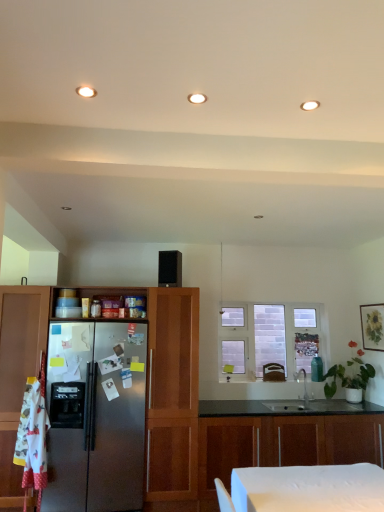
Question: From their relative heights in the image, would you say matte wooden picture frame at upper right is taller or shorter than white brick window at center?

Choices:
 (A) tall
 (B) short

Answer: (B)

Question: Is matte wooden picture frame at upper right spatially inside white brick window at center, or outside of it?

Choices:
 (A) outside
 (B) inside

Answer: (A)

Question: Based on their relative distances, which object is nearer to the white brick window at center?

Choices:
 (A) satin wood cabinet at left, the second cabinetry positioned from the bottom
 (B) wooden cabinets at center, which is the second cabinetry from top to bottom
 (C) satin nickel faucet at center
 (D) black matte speaker at center
 (E) matte wooden picture frame at upper right

Answer: (C)

Question: Considering the real-world distances, which object is closest to the white brick window at center?

Choices:
 (A) matte wooden picture frame at upper right
 (B) satin nickel faucet at center
 (C) brown leather swivel chair at center
 (D) satin wood cabinet at left, acting as the first cabinetry starting from the top
 (E) wooden cabinets at center, which is the second cabinetry from top to bottom

Answer: (C)